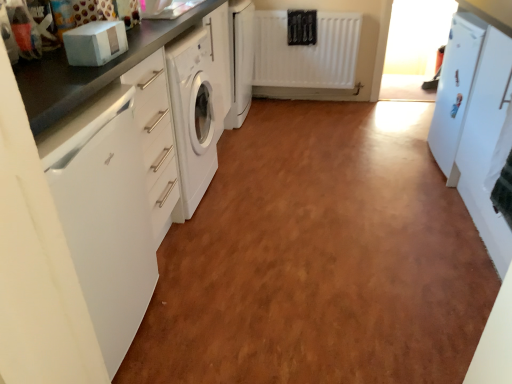
You are a GUI agent. You are given a task and a screenshot of the screen. Output one action in this format:
    pyautogui.click(x=<x>, y=<y>)
    Task: Click on the spots to the right of white glossy washing machine at center, which appears as the second cabinetry when ordered from the bottom
    The width and height of the screenshot is (512, 384).
    Given the screenshot: What is the action you would take?
    291,119